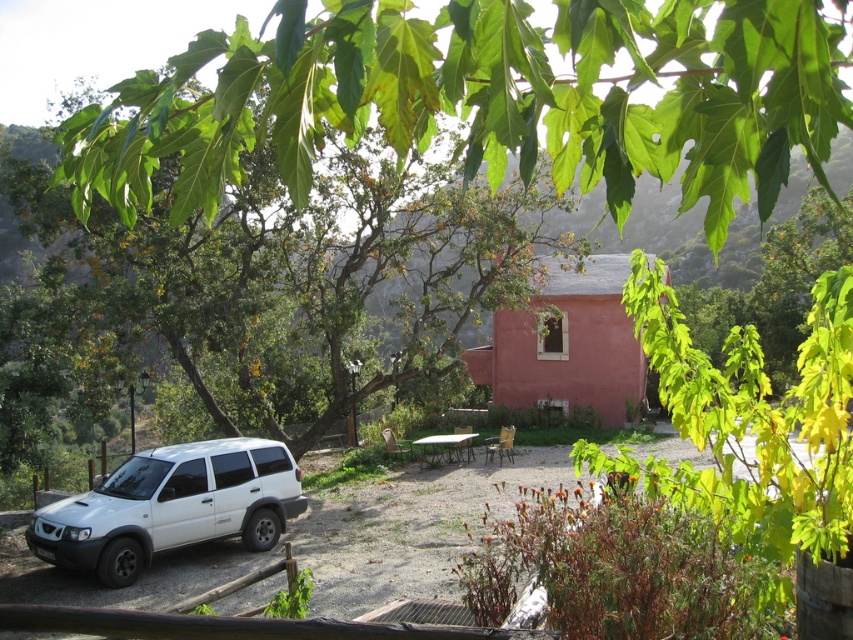
Which is above, white matte suv at lower left or wooden picnic table at center?

Positioned higher is white matte suv at lower left.

Does point (155, 477) come in front of point (469, 432)?

Yes.

Find the location of a particular element. white matte suv at lower left is located at coordinates (171, 506).

Who is taller, green leafy tree at upper center or wooden picnic table at center?

green leafy tree at upper center

Is point (227, 45) farther from viewer compared to point (451, 435)?

No, it is not.

Where is `green leafy tree at upper center`? Image resolution: width=853 pixels, height=640 pixels. green leafy tree at upper center is located at coordinates (486, 99).

Does point (169, 109) come in front of point (78, 512)?

Yes, it is in front of point (78, 512).

Between green leafy tree at upper center and white matte suv at lower left, which one is positioned higher?

green leafy tree at upper center

Describe the element at coordinates (486, 99) in the screenshot. I see `green leafy tree at upper center` at that location.

Locate an element on the screen. The width and height of the screenshot is (853, 640). green leafy tree at upper center is located at coordinates (486, 99).